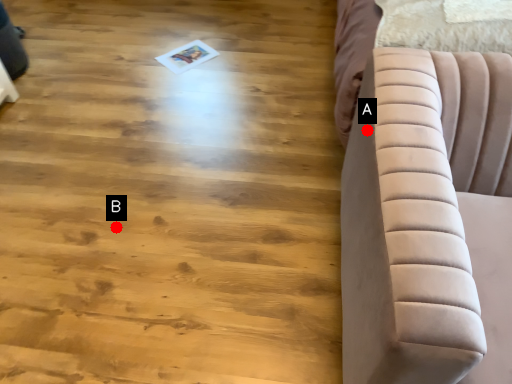
Question: Two points are circled on the image, labeled by A and B beside each circle. Which of the following is the farthest from the observer?

Choices:
 (A) A is further
 (B) B is further

Answer: (B)